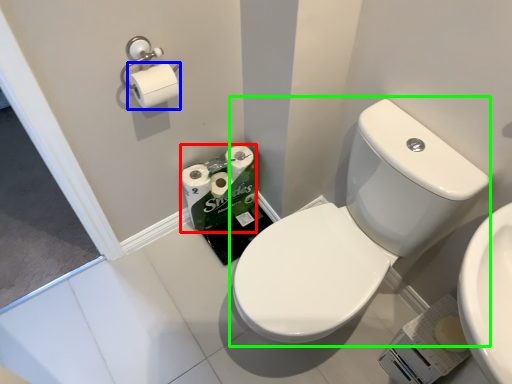
Question: Estimate the real-world distances between objects in this image. Which object is closer to toilet paper (highlighted by a red box), toilet paper (highlighted by a blue box) or sink (highlighted by a green box)?

Choices:
 (A) toilet paper
 (B) sink

Answer: (A)